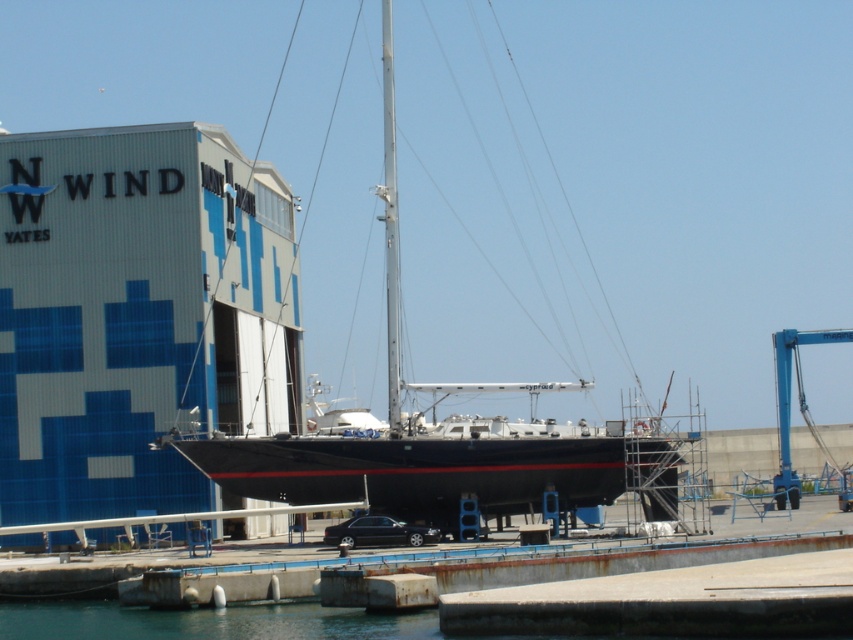
Question: Based on their relative distances, which object is farther from the silver metallic mast at center?

Choices:
 (A) transparent blue water at lower left
 (B) black glossy sailboat at center
 (C) blue metallic crane at right

Answer: (C)

Question: Based on their relative distances, which object is farther from the silver metallic mast at center?

Choices:
 (A) black glossy sailboat at center
 (B) transparent blue water at lower left
 (C) blue metallic crane at right

Answer: (C)

Question: Can you confirm if black glossy sailboat at center is positioned to the right of silver metallic mast at center?

Choices:
 (A) no
 (B) yes

Answer: (B)

Question: Is silver metallic mast at center below blue metallic crane at right?

Choices:
 (A) yes
 (B) no

Answer: (B)

Question: Is black glossy sailboat at center above blue metallic crane at right?

Choices:
 (A) yes
 (B) no

Answer: (B)

Question: Among these points, which one is nearest to the camera?

Choices:
 (A) (451, 445)
 (B) (91, 609)

Answer: (B)